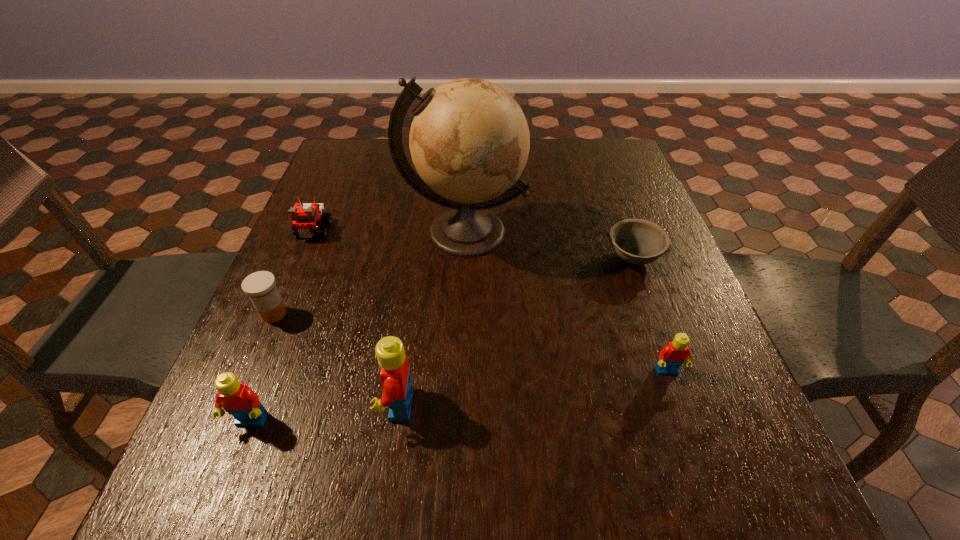
The image size is (960, 540). Find the location of `the fifth shortest object`. the fifth shortest object is located at coordinates (237, 399).

Locate an element on the screen. The width and height of the screenshot is (960, 540). the second Lego from right to left is located at coordinates (396, 382).

Locate an element on the screen. This screenshot has height=540, width=960. the second tallest object is located at coordinates (396, 382).

Identify the location of the rightmost Lego. 671,357.

I want to click on bowl, so click(636, 241).

Find the location of a particular element. the farthest Lego is located at coordinates (306, 217).

The image size is (960, 540). In order to click on the tallest object in this screenshot , I will do `click(469, 140)`.

The height and width of the screenshot is (540, 960). In order to click on medicine in this screenshot , I will do `click(260, 286)`.

Where is `vacant position located 0.180m on the face of the second Lego from right to left`? vacant position located 0.180m on the face of the second Lego from right to left is located at coordinates (276, 404).

The height and width of the screenshot is (540, 960). I want to click on free space located on the face of the second Lego from right to left, so click(x=257, y=404).